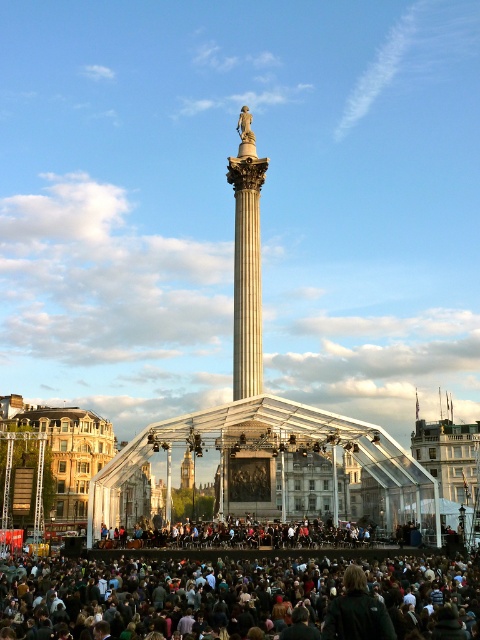
Consider the image. Which is more to the right, polished stone column at center or bronze statue at center?

From the viewer's perspective, bronze statue at center appears more on the right side.

Is polished stone column at center below bronze statue at center?

Indeed, polished stone column at center is positioned under bronze statue at center.

Image resolution: width=480 pixels, height=640 pixels. I want to click on polished stone column at center, so click(x=267, y=413).

Who is higher up, polished stone column at center or white marble column at center?

Positioned higher is white marble column at center.

Does point (387, 506) lie in front of point (233, 272)?

Yes.

Which is behind, point (245, 154) or point (227, 173)?

The point (227, 173) is behind.

Locate an element on the screen. polished stone column at center is located at coordinates (267, 413).

Is the position of dark brown hair at lower center more distant than that of bronze statue at center?

No, dark brown hair at lower center is in front of bronze statue at center.

Which is more to the right, dark brown hair at lower center or bronze statue at center?

Positioned to the right is dark brown hair at lower center.

Between point (84, 637) and point (248, 125), which one is positioned behind?

Point (248, 125)

You are a GUI agent. You are given a task and a screenshot of the screen. Output one action in this format:
    pyautogui.click(x=<x>, y=<y>)
    Task: Click on the dark brown hair at lower center
    This screenshot has width=480, height=640.
    Given the screenshot: What is the action you would take?
    pyautogui.click(x=236, y=598)